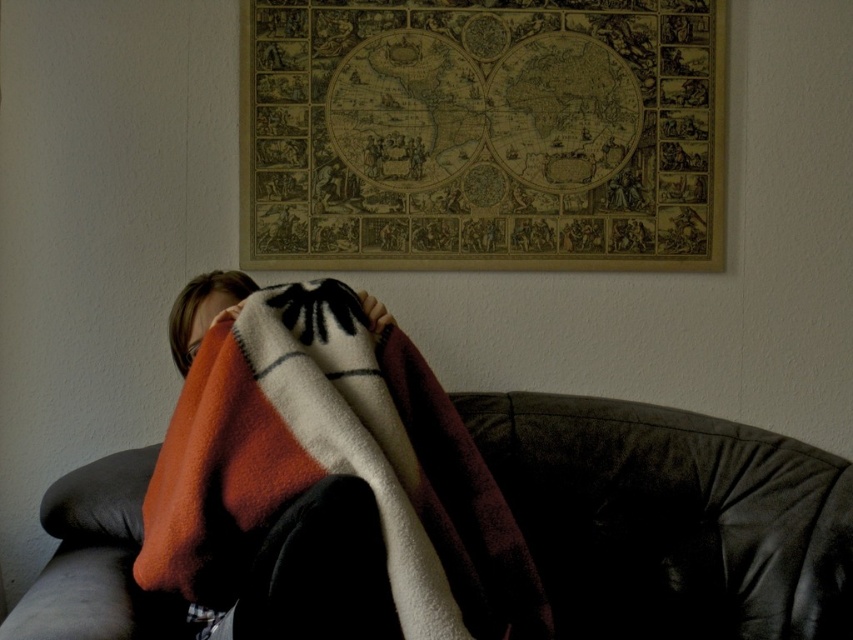
You are standing at the point marked as point (x=165, y=560) in the image. You want to reach the door located at the opposite side of the room without moving your feet. Can you stretch your arm to reach the doorknob? Assume your arm can extend 3.5 feet.

The distance between you and the viewer is 4.45 feet, which is greater than your arm extension of 3.5 feet. Therefore, you cannot reach the doorknob without moving your feet.

You are a delivery person holding a package that requires a 1.5 meter clearance to deliver it safely. You are standing in front of the leather couch at center. Can you move the package through the space between you and the couch without hitting anything?

The leather couch at center is 1.62 meters from the camera, so there is enough space to move the package through the space between you and the couch without hitting anything since 1.62 meters is greater than the required 1.5 meter clearance.

You are a delivery person trying to see the face of the person under the blanket. Can you see the smooth skin face at center clearly through the multicolored fleece blanket at center?

The multicolored fleece blanket at center is larger in size than the smooth skin face at center, so it might cover the face, making it difficult to see clearly.